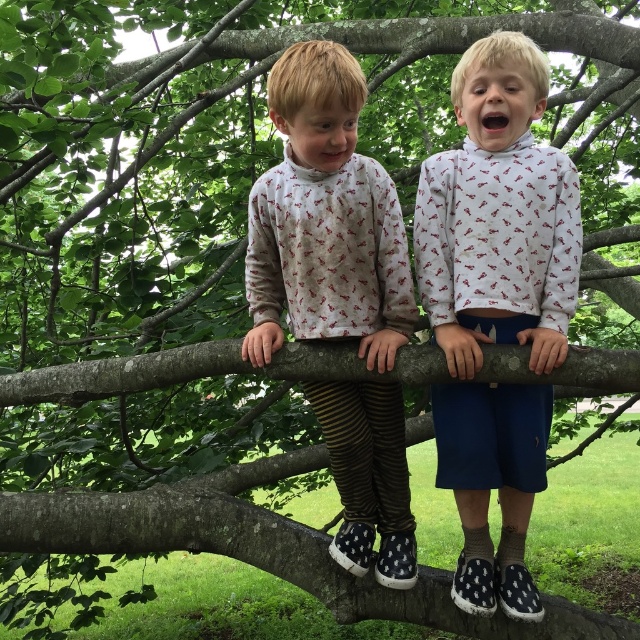
Between point (460, 100) and point (365, 310), which one is positioned in front?

Point (365, 310) is more forward.

Is white printed sweatshirt at center smaller than striped leggings at center?

Correct, white printed sweatshirt at center occupies less space than striped leggings at center.

Describe the element at coordinates (499, 216) in the screenshot. I see `white printed sweatshirt at center` at that location.

At what (x,y) coordinates should I click in order to perform the action: click on white printed sweatshirt at center. Please return your answer as a coordinate pair (x, y). The width and height of the screenshot is (640, 640). Looking at the image, I should click on (499, 216).

Is white printed sweatshirt at center to the left of smooth bark tree limb at center from the viewer's perspective?

Incorrect, white printed sweatshirt at center is not on the left side of smooth bark tree limb at center.

Does point (518, 310) come behind point (493, 369)?

Yes, point (518, 310) is farther from viewer.

Locate an element on the screen. white printed sweatshirt at center is located at coordinates (499, 216).

Identify the location of striped leggings at center. The height and width of the screenshot is (640, 640). (324, 220).

Describe the element at coordinates (324, 220) in the screenshot. I see `striped leggings at center` at that location.

You are a GUI agent. You are given a task and a screenshot of the screen. Output one action in this format:
    pyautogui.click(x=<x>, y=<y>)
    Task: Click on the striped leggings at center
    
    Given the screenshot: What is the action you would take?
    pyautogui.click(x=324, y=220)

Image resolution: width=640 pixels, height=640 pixels. Find the location of `striped leggings at center`. striped leggings at center is located at coordinates click(x=324, y=220).